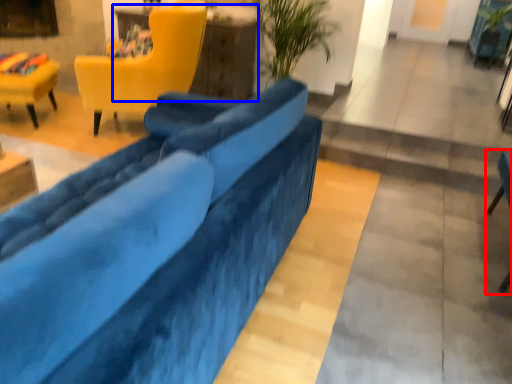
Question: Which of the following is the closest to the observer, chair (highlighted by a red box) or table (highlighted by a blue box)?

Choices:
 (A) chair
 (B) table

Answer: (A)